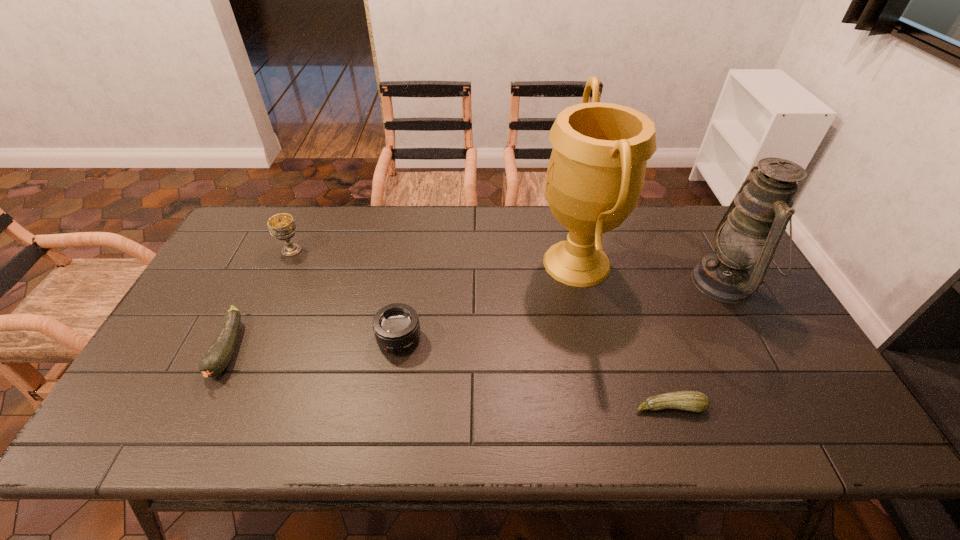
The image size is (960, 540). In order to click on object situated at the left edge in this screenshot , I will do `click(216, 359)`.

Locate an element on the screen. object located in the right edge section of the desktop is located at coordinates (750, 230).

In the image, there is a desktop. What are the coordinates of `vacant space at the far edge` in the screenshot? It's located at (652, 212).

What are the coordinates of `free space at the near edge of the desktop` in the screenshot? It's located at (271, 443).

At what (x,y) coordinates should I click in order to perform the action: click on vacant space at the left edge. Please return your answer as a coordinate pair (x, y). The height and width of the screenshot is (540, 960). Looking at the image, I should click on (201, 379).

This screenshot has width=960, height=540. What are the coordinates of `vacant position at the right edge of the desktop` in the screenshot? It's located at (785, 384).

Find the location of a particular element. Image resolution: width=960 pixels, height=540 pixels. vacant space at the near left corner is located at coordinates (114, 437).

Find the location of a particular element. Image resolution: width=960 pixels, height=540 pixels. vacant region between the fourth object from right to left and the shorter zucchini is located at coordinates (535, 373).

I want to click on vacant space that is in between the telephoto lens and the farther zucchini, so click(314, 345).

Where is `free area in between the shorter zucchini and the taller zucchini`? free area in between the shorter zucchini and the taller zucchini is located at coordinates (449, 378).